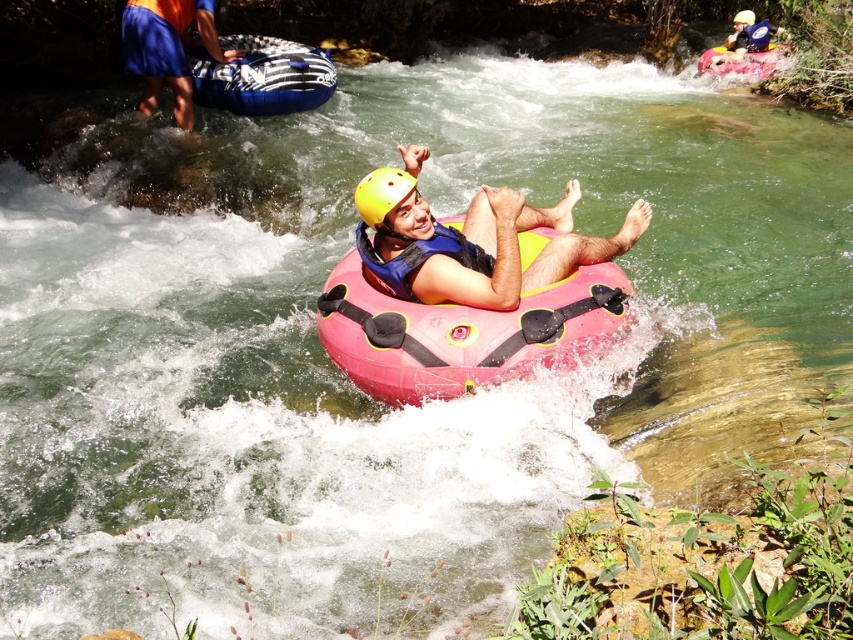
You are a photographer trying to capture the perfect shot of the pink rubber raft at center and the yellow matte helmet at center. Which object should you focus on first to ensure it appears larger in your photo?

The pink rubber raft at center is closer to the viewer than the yellow matte helmet at center, so focusing on it first will make it appear larger in the photo.

You are a photographer trying to capture the perfect shot of the matte pink tube at center and the blue rubber raft at upper center. From which object should you position yourself to the left to frame both in the shot?

You should position yourself to the left of the blue rubber raft at upper center because the matte pink tube at center is to the right of it.

You are a photographer trying to capture both the yellow matte helmet at center and the yellow matte helmet at upper center in a single shot. Which helmet should you focus on first to ensure both are in frame?

You should focus on the yellow matte helmet at upper center first because it is larger and will help frame the shot to include the smaller yellow matte helmet at center.